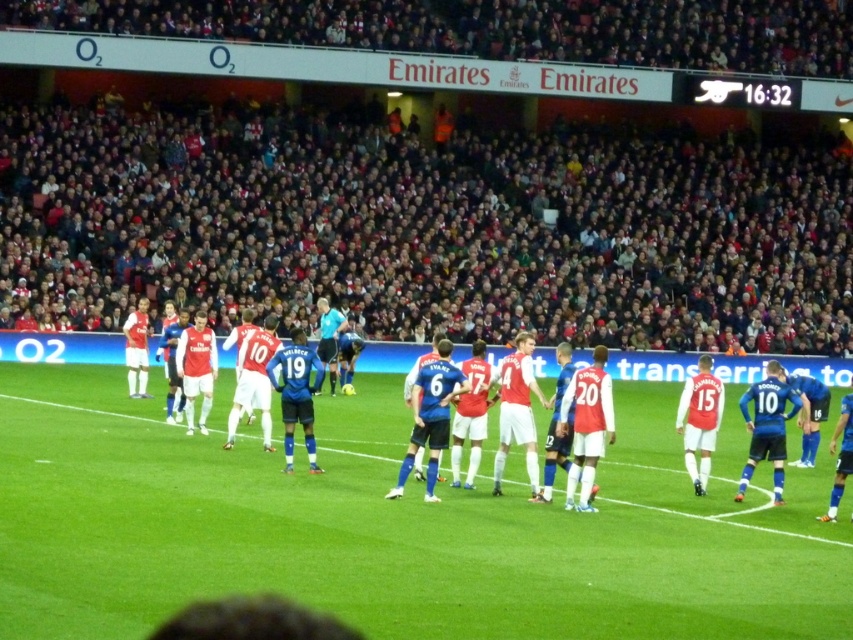
You are a player on the field and want to kick the ball towards the goal. The ball is currently on the green grass football field at center. Where is the white jersey at center located relative to the ball?

The white jersey at center is above the green grass football field at center, so the ball is below the jersey.

You are a soccer coach analyzing the field layout. The green grass football field at center and the white jersey at center are both visible. Which one appears wider in the image?

The white jersey at center appears wider because the green grass football field at center has a lesser width compared to it.

You are a soccer player standing on the green grass football field at center. You need to pass the ball to your teammate wearing the white jersey at center. In which direction should you pass the ball to reach your teammate?

The green grass football field at center is positioned on the left side of white jersey at center, so you should pass the ball to the right to reach your teammate.